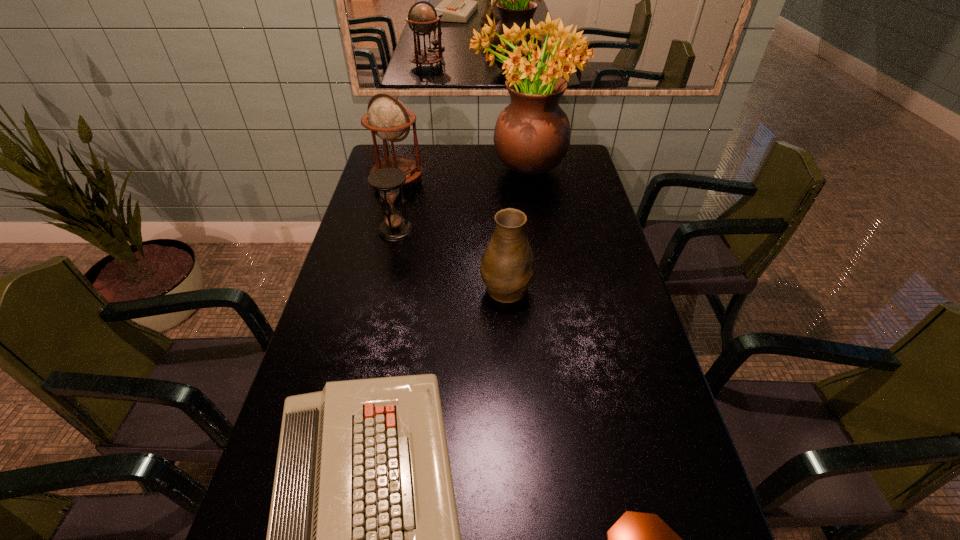
This screenshot has width=960, height=540. What are the coordinates of `flower arrangement` in the screenshot? It's located at (532, 134).

Where is `the fifth shortest object`? This screenshot has height=540, width=960. the fifth shortest object is located at coordinates (388, 118).

The height and width of the screenshot is (540, 960). Find the location of `the third nearest object`. the third nearest object is located at coordinates (507, 267).

Locate an element on the screen. the fourth shortest object is located at coordinates (507, 267).

Locate an element on the screen. the left hourglass is located at coordinates (387, 180).

Locate an element on the screen. The width and height of the screenshot is (960, 540). the farther hourglass is located at coordinates (387, 180).

This screenshot has height=540, width=960. What are the coordinates of `blank space located on the front of the tallest object` in the screenshot? It's located at (534, 247).

This screenshot has width=960, height=540. I want to click on vacant space located 0.140m on the surface of the globe, so click(x=389, y=217).

Identify the location of vacant region located on the handle side of the third nearest object. (x=503, y=226).

Locate an element on the screen. The width and height of the screenshot is (960, 540). vacant space located on the handle side of the third nearest object is located at coordinates (503, 232).